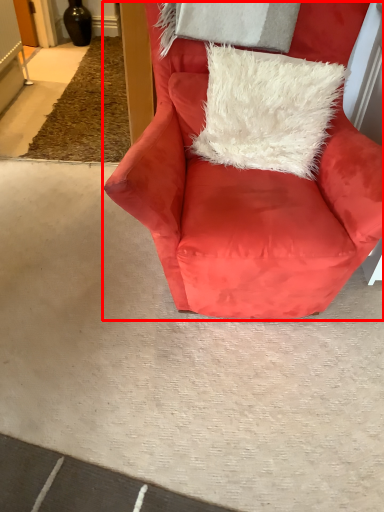
Question: In this image, where is chair (annotated by the red box) located relative to pillow?

Choices:
 (A) right
 (B) left

Answer: (B)